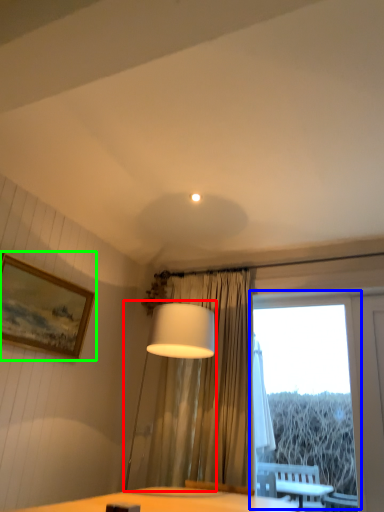
Question: Which object is the farthest from table lamp (highlighted by a red box)? Choose among these: window (highlighted by a blue box) or picture frame (highlighted by a green box).

Choices:
 (A) window
 (B) picture frame

Answer: (A)